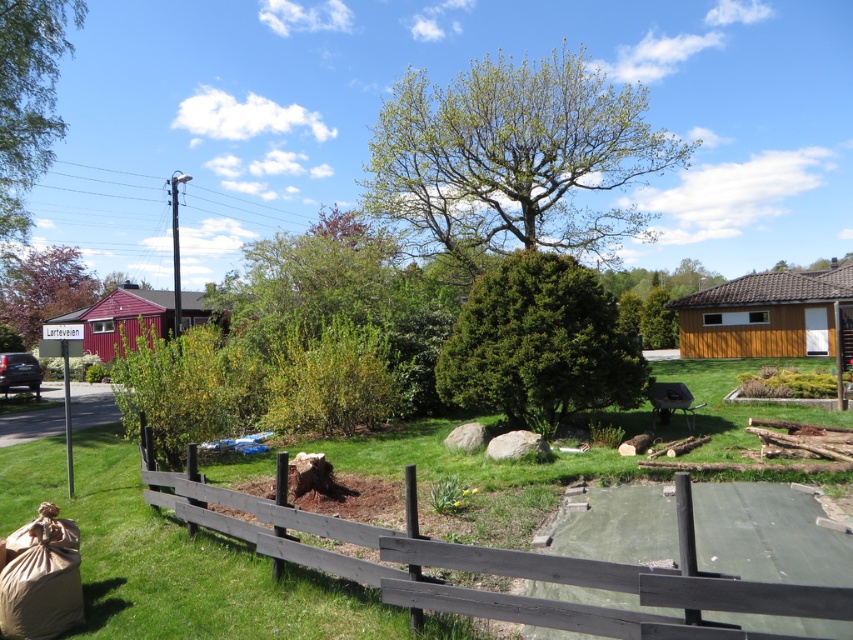
You are a visitor in the suburban area and want to know which tree is taller between the green leafy tree at center and the green leafy tree at upper left. Can you tell me?

The green leafy tree at center is taller than the green leafy tree at upper left.